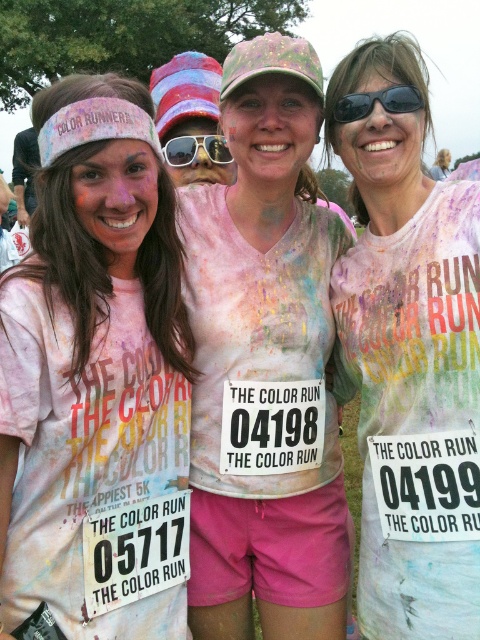
Question: Which of the following is the farthest from the observer?

Choices:
 (A) matte white t-shirt at center
 (B) matte white headband at upper left
 (C) sunglasses at center

Answer: (C)

Question: Is matte white headband at upper left bigger than matte white t-shirt at center?

Choices:
 (A) no
 (B) yes

Answer: (A)

Question: Considering the real-world distances, which object is farthest from the sunglasses at center?

Choices:
 (A) matte white t-shirt at center
 (B) matte white headband at upper left

Answer: (B)

Question: Is matte white headband at upper left to the right of sunglasses at center from the viewer's perspective?

Choices:
 (A) yes
 (B) no

Answer: (B)

Question: Estimate the real-world distances between objects in this image. Which object is closer to the matte white t-shirt at center?

Choices:
 (A) matte white headband at upper left
 (B) black plastic sunglasses at upper center

Answer: (B)

Question: Is matte white headband at upper left positioned before black plastic sunglasses at upper center?

Choices:
 (A) no
 (B) yes

Answer: (B)